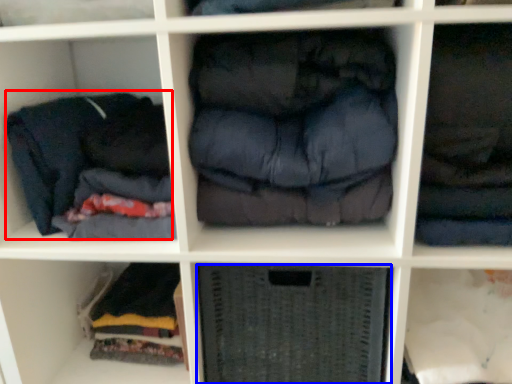
Question: Which object appears closest to the camera in this image, clothing (highlighted by a red box) or shelf (highlighted by a blue box)?

Choices:
 (A) clothing
 (B) shelf

Answer: (A)